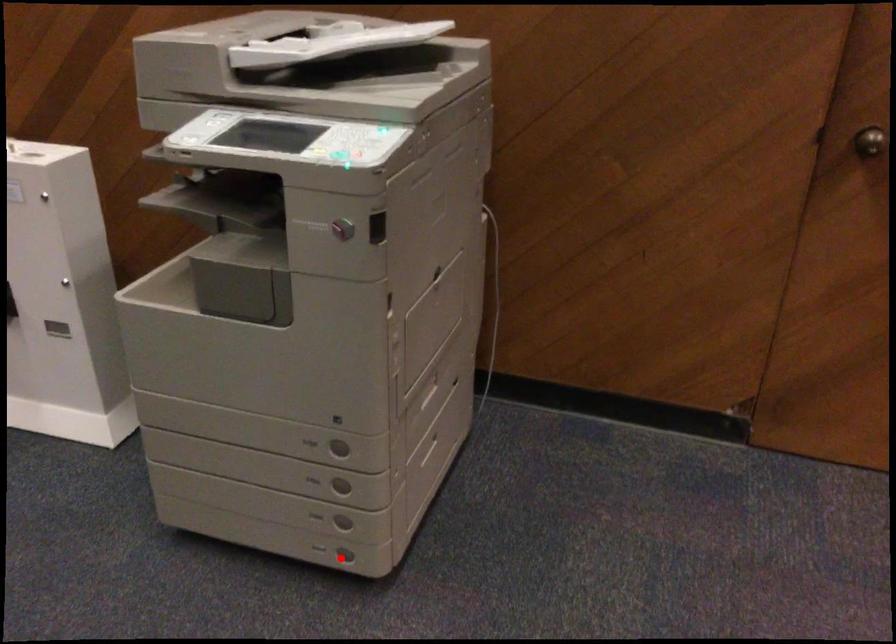
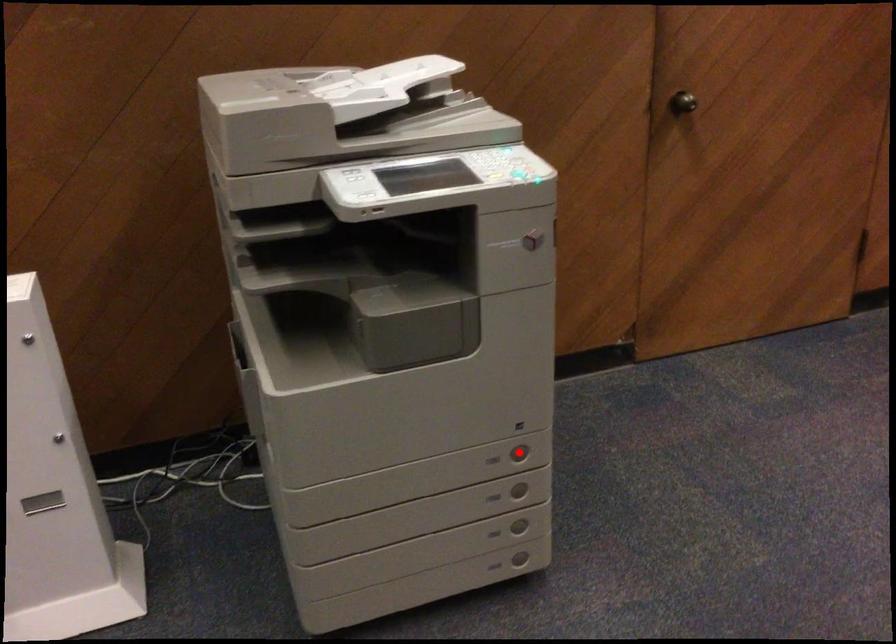
I am providing you with two images of the same scene from different viewpoints. A red point is marked on the first image and another point is marked on the second image. Do the highlighted points in image1 and image2 indicate the same real-world spot?

No